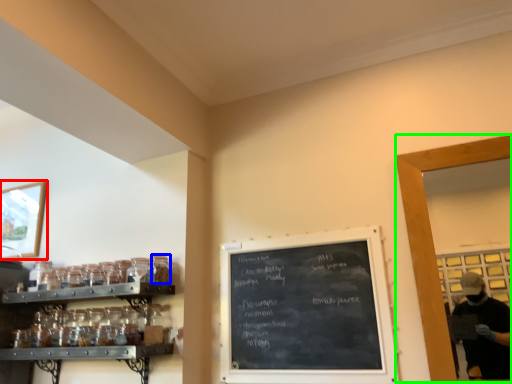
Question: Which object is positioned closest to picture frame (highlighted by a red box)? Select from glass jar (highlighted by a blue box) and glass door (highlighted by a green box).

Choices:
 (A) glass jar
 (B) glass door

Answer: (A)